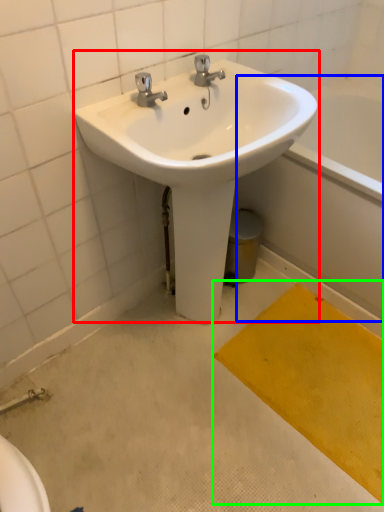
Question: Based on their relative distances, which object is farther from sink (highlighted by a red box)? Choose from bath (highlighted by a blue box) and doormat (highlighted by a green box).

Choices:
 (A) bath
 (B) doormat

Answer: (B)